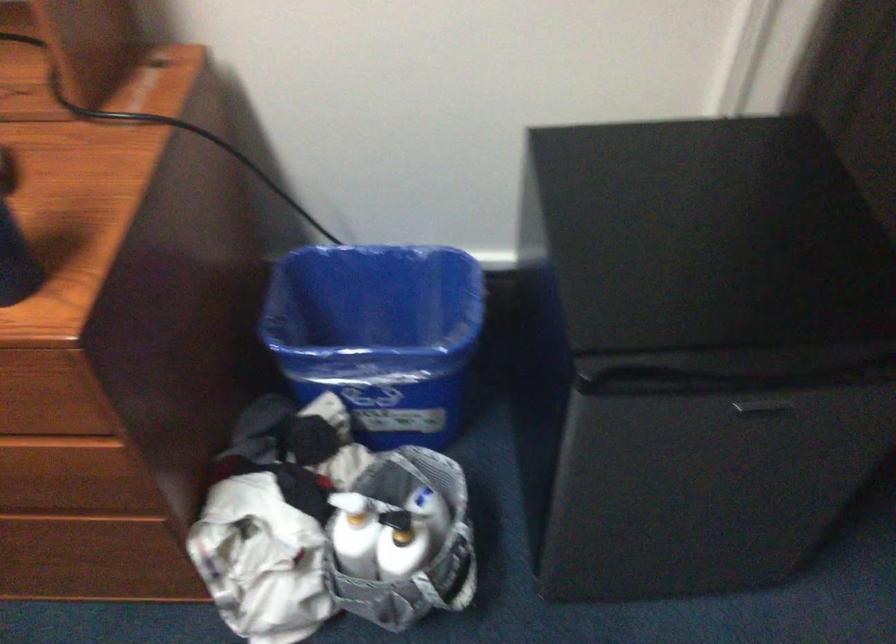
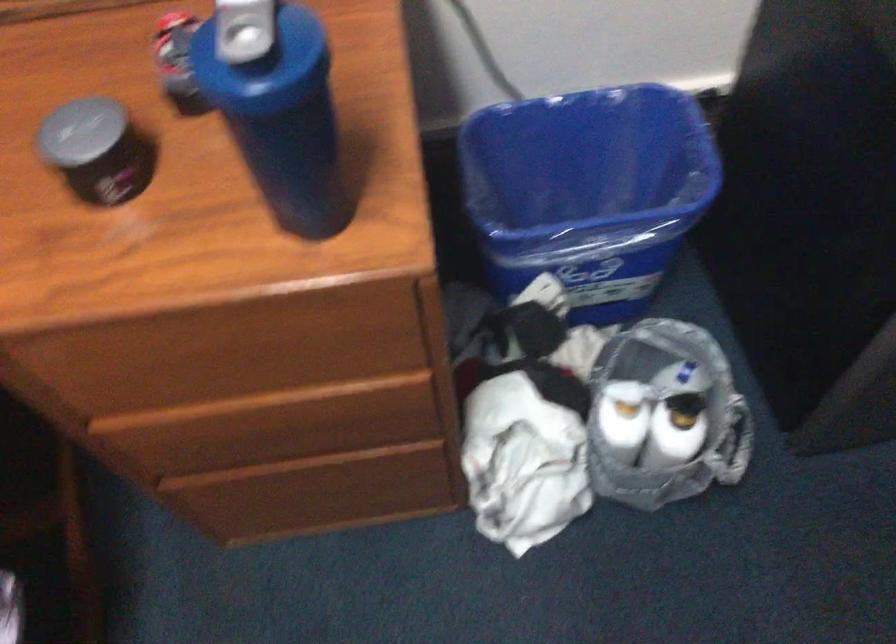
Where in the second image is the point corresponding to (395,534) from the first image?

(676, 417)